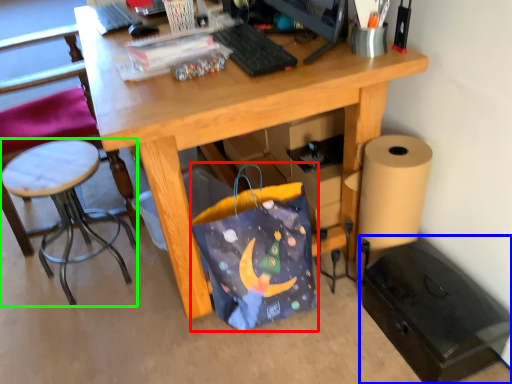
Question: Which object is positioned closest to bag (highlighted by a red box)? Select from file cabinet (highlighted by a blue box) and stool (highlighted by a green box).

Choices:
 (A) file cabinet
 (B) stool

Answer: (A)